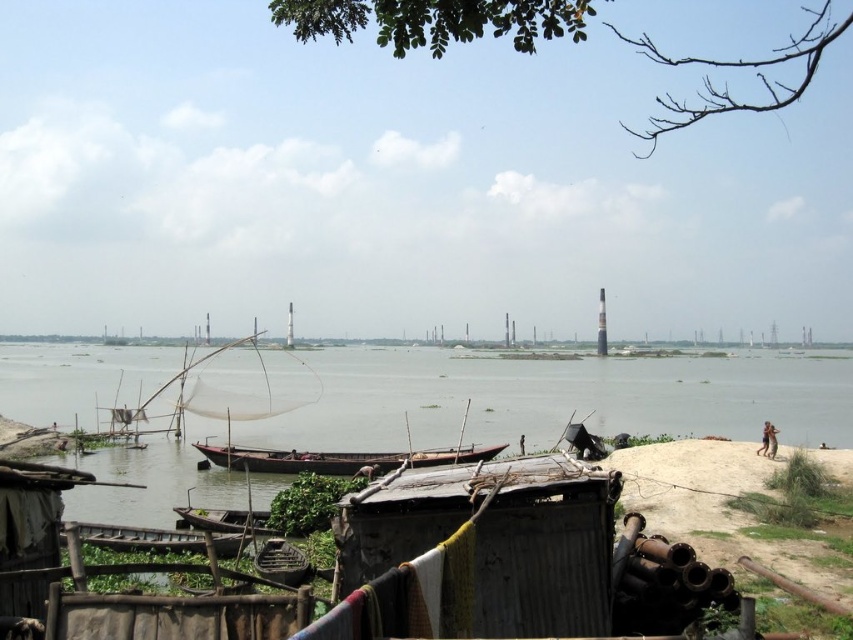
You are standing at the origin point of the image coordinate system. You want to move towards the wooden boat at center. In which direction should you move to reach it?

Since the wooden boat at center is located at coordinate point 0.717 on the x axis and 0.397 on the y axis, you should move towards the right and slightly downward to reach it.

You are standing on the riverside and see two wooden boats. The first is the wooden boat at center and the second is the wooden boat at lower left. Which boat is positioned more to the right side of the scene?

The wooden boat at center is positioned more to the right side of the scene compared to the wooden boat at lower left.